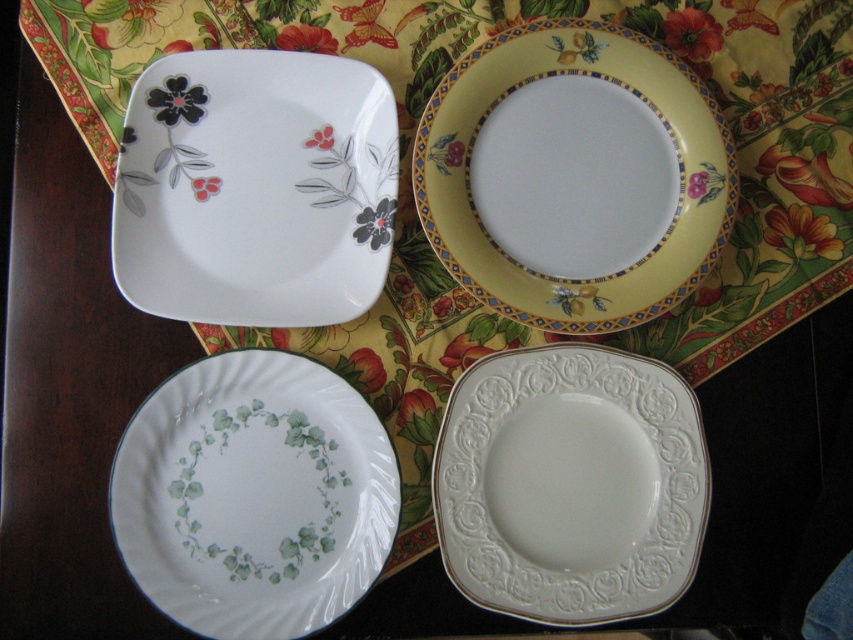
Which is more to the left, white porcelain saucer at bottom left or white porcelain saucer at bottom right?

From the viewer's perspective, white porcelain saucer at bottom left appears more on the left side.

Who is shorter, white porcelain saucer at bottom left or white porcelain saucer at bottom right?

white porcelain saucer at bottom right

Measure the distance between white porcelain saucer at bottom left and camera.

white porcelain saucer at bottom left and camera are 85.78 centimeters apart.

Identify the location of white porcelain saucer at bottom left. (254, 497).

Between point (244, 65) and point (646, 596), which one is positioned behind?

Positioned behind is point (244, 65).

Who is lower down, white glossy square plate at upper left or white porcelain saucer at bottom right?

white porcelain saucer at bottom right

Between point (202, 285) and point (671, 426), which one is positioned in front?

Point (202, 285) is in front.

At what (x,y) coordinates should I click in order to perform the action: click on white glossy square plate at upper left. Please return your answer as a coordinate pair (x, y). This screenshot has height=640, width=853. Looking at the image, I should click on (254, 188).

Is white porcelain saucer at bottom right wider than yellow glossy plate at upper center?

No.

This screenshot has height=640, width=853. Describe the element at coordinates (570, 484) in the screenshot. I see `white porcelain saucer at bottom right` at that location.

Locate an element on the screen. Image resolution: width=853 pixels, height=640 pixels. white porcelain saucer at bottom right is located at coordinates (570, 484).